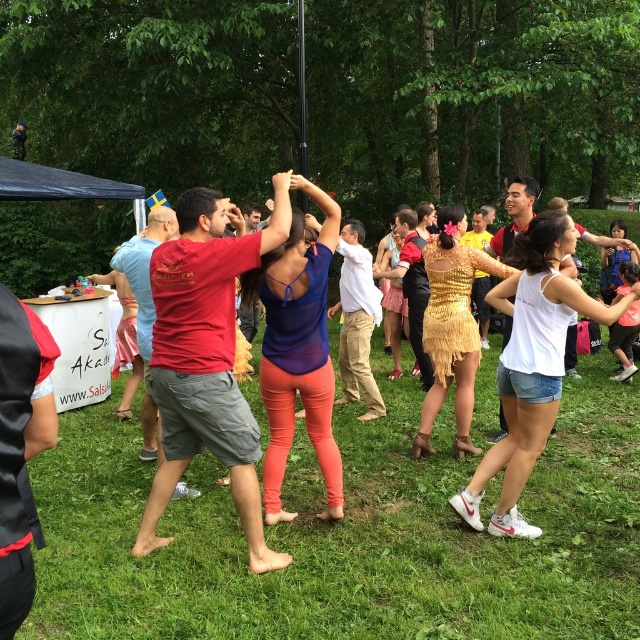
Question: Which point is closer to the camera?

Choices:
 (A) white matte tank top at center
 (B) matte red t-shirt at center

Answer: (B)

Question: Among these objects, which one is farthest from the camera?

Choices:
 (A) matte red t-shirt at center
 (B) green grass at center
 (C) white matte tank top at center

Answer: (C)

Question: Can you confirm if green grass at center is positioned to the left of white matte tank top at center?

Choices:
 (A) no
 (B) yes

Answer: (B)

Question: Which object is farther from the camera taking this photo?

Choices:
 (A) green grass at center
 (B) matte red t-shirt at center
 (C) white matte tank top at center

Answer: (C)

Question: Does green grass at center have a smaller size compared to white matte tank top at center?

Choices:
 (A) yes
 (B) no

Answer: (A)

Question: Considering the relative positions of green grass at center and white matte tank top at center in the image provided, where is green grass at center located with respect to white matte tank top at center?

Choices:
 (A) above
 (B) below

Answer: (B)